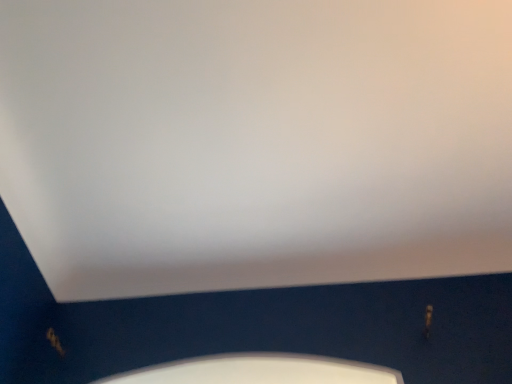
This screenshot has width=512, height=384. Find the location of `white glossy lampshade at lower center`. white glossy lampshade at lower center is located at coordinates (259, 371).

In order to face white glossy lampshade at lower center, should I rotate leftwards or rightwards?

Turn left by 1.117 degrees to look at white glossy lampshade at lower center.

This screenshot has height=384, width=512. Describe the element at coordinates (259, 371) in the screenshot. I see `white glossy lampshade at lower center` at that location.

Where is `white glossy lampshade at lower center`? white glossy lampshade at lower center is located at coordinates (259, 371).